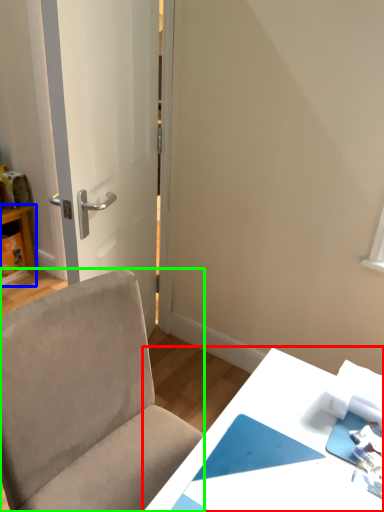
Question: Which object is the closest to the table (highlighted by a red box)? Choose among these: table (highlighted by a blue box) or chair (highlighted by a green box).

Choices:
 (A) table
 (B) chair

Answer: (B)